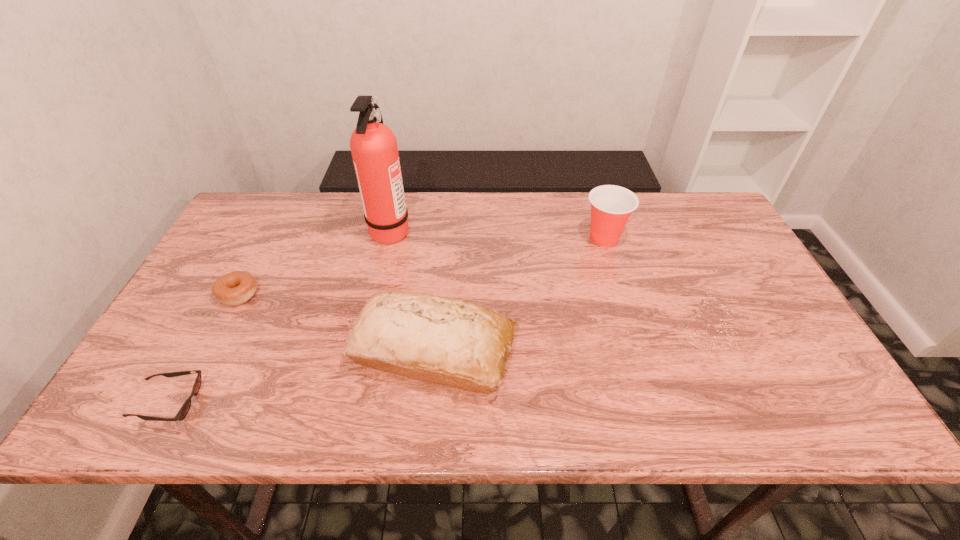
The width and height of the screenshot is (960, 540). In order to click on vacant space that satisfies the following two spatial constraints: 1. on the handle side of the bread; 2. on the left side of the tallest object in this screenshot , I will do `click(364, 350)`.

The height and width of the screenshot is (540, 960). Find the location of `free space that satisfies the following two spatial constraints: 1. on the front side of the bagel; 2. on the front-facing side of the sunglasses`. free space that satisfies the following two spatial constraints: 1. on the front side of the bagel; 2. on the front-facing side of the sunglasses is located at coordinates (182, 402).

Where is `free spot that satisfies the following two spatial constraints: 1. on the handle side of the fire extinguisher; 2. on the left side of the bread`? free spot that satisfies the following two spatial constraints: 1. on the handle side of the fire extinguisher; 2. on the left side of the bread is located at coordinates (364, 350).